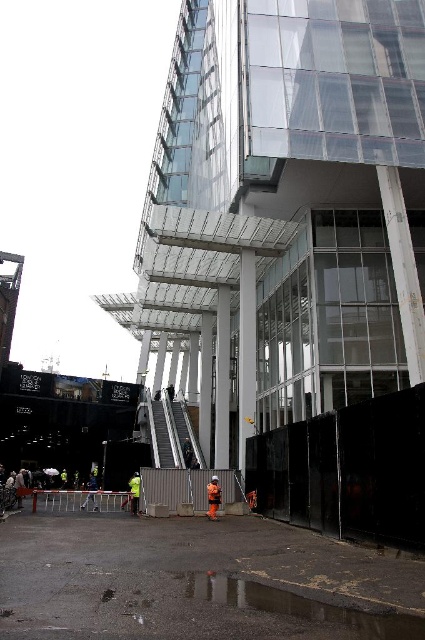
Can you confirm if metallic gray barricade at lower center is positioned below metal barricade at lower center?

No.

Is metallic gray barricade at lower center wider than metal barricade at lower center?

No.

Between point (226, 492) and point (107, 512), which one is positioned behind?

Point (107, 512)

Find the location of a particular element. The height and width of the screenshot is (640, 425). metallic gray barricade at lower center is located at coordinates (187, 486).

Based on the photo, is the position of metallic gray barricade at lower center less distant than that of metallic silver escalator at center?

That is True.

Who is taller, metallic gray barricade at lower center or metallic silver escalator at center?

With more height is metallic silver escalator at center.

What do you see at coordinates (187, 486) in the screenshot? This screenshot has height=640, width=425. I see `metallic gray barricade at lower center` at bounding box center [187, 486].

Locate an element on the screen. metallic gray barricade at lower center is located at coordinates (187, 486).

Can you confirm if concrete pavement at lower center is positioned to the right of metal barricade at lower center?

Correct, you'll find concrete pavement at lower center to the right of metal barricade at lower center.

Is point (99, 545) positioned in front of point (115, 493)?

That is True.

Which is behind, point (320, 547) or point (48, 502)?

The point (48, 502) is behind.

Identify the location of concrete pavement at lower center. Image resolution: width=425 pixels, height=640 pixels. (198, 580).